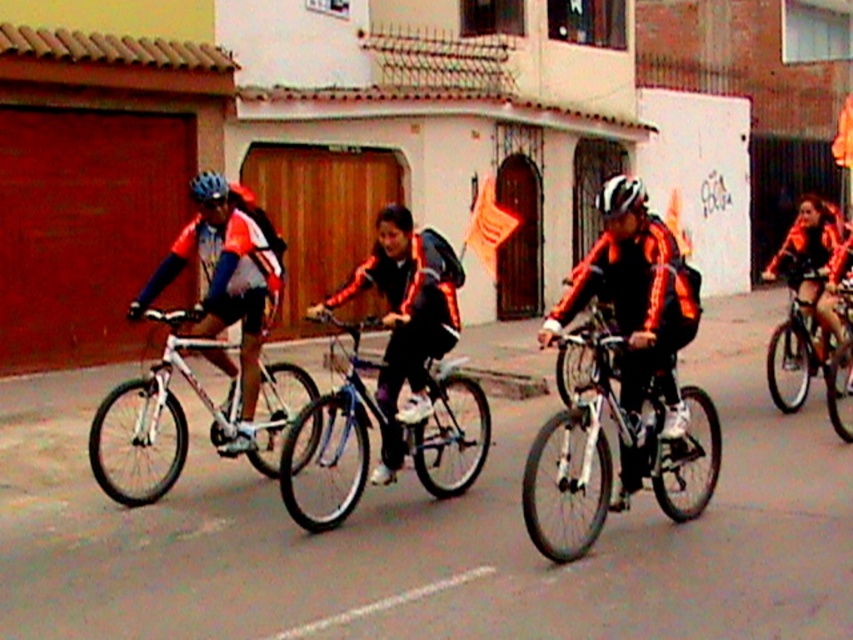
You are a photographer standing on the sidewalk next to the cyclists. You want to take a photo of the blue metallic bicycle at center without including the matte blue helmet at left in the frame. Is it possible to do so while keeping the bicycle centered?

The matte blue helmet at left is positioned over the blue metallic bicycle at center, so it would block the view of the bicycle. Therefore, it is not possible to take a photo of the blue metallic bicycle at center without including the matte blue helmet at left in the frame while keeping the bicycle centered.

You are a photographer trying to capture a cyclist wearing a matte blue helmet at left and a cyclist wearing a blue matte bicycle helmet at upper left. Which helmet would appear larger in your photo?

The matte blue helmet at left appears larger in the photo because it is much taller than the blue matte bicycle helmet at upper left.